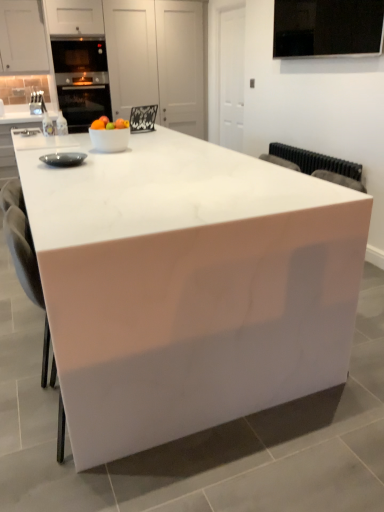
Question: From their relative heights in the image, would you say white glossy table at center is taller or shorter than white glossy bowl at center?

Choices:
 (A) short
 (B) tall

Answer: (B)

Question: From a real-world perspective, relative to white glossy bowl at center, is white glossy table at center vertically above or below?

Choices:
 (A) above
 (B) below

Answer: (B)

Question: Which object is the closest to the matte black bowl at left?

Choices:
 (A) white glossy bowl at center
 (B) white glossy table at center

Answer: (A)

Question: Which object is positioned closest to the white glossy bowl at center?

Choices:
 (A) white glossy table at center
 (B) matte black bowl at left

Answer: (B)